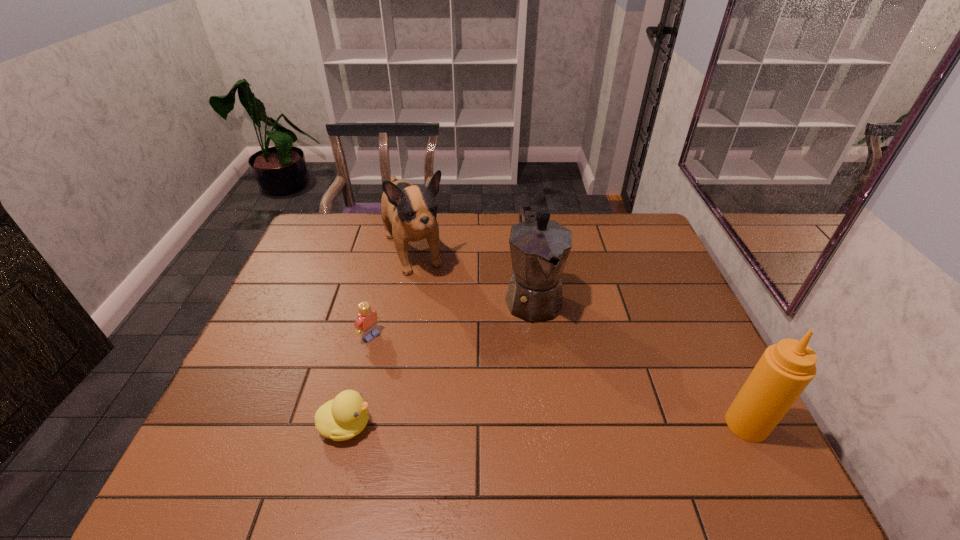
The height and width of the screenshot is (540, 960). Identify the location of free space that satisfies the following two spatial constraints: 1. on the front side of the rightmost object; 2. on the right side of the fourth object from left to right. (550, 424).